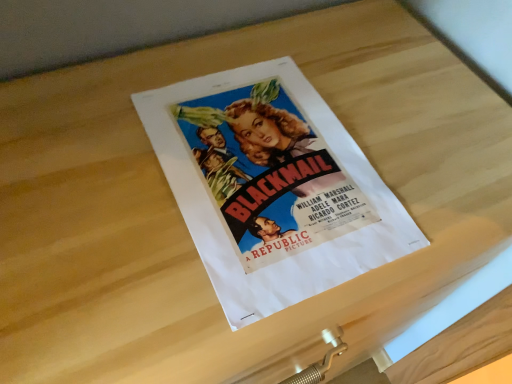
Image resolution: width=512 pixels, height=384 pixels. In order to click on matte paper poster at center in this screenshot , I will do `click(271, 187)`.

Describe the element at coordinates (271, 187) in the screenshot. The height and width of the screenshot is (384, 512). I see `matte paper poster at center` at that location.

This screenshot has width=512, height=384. I want to click on matte paper poster at center, so click(x=271, y=187).